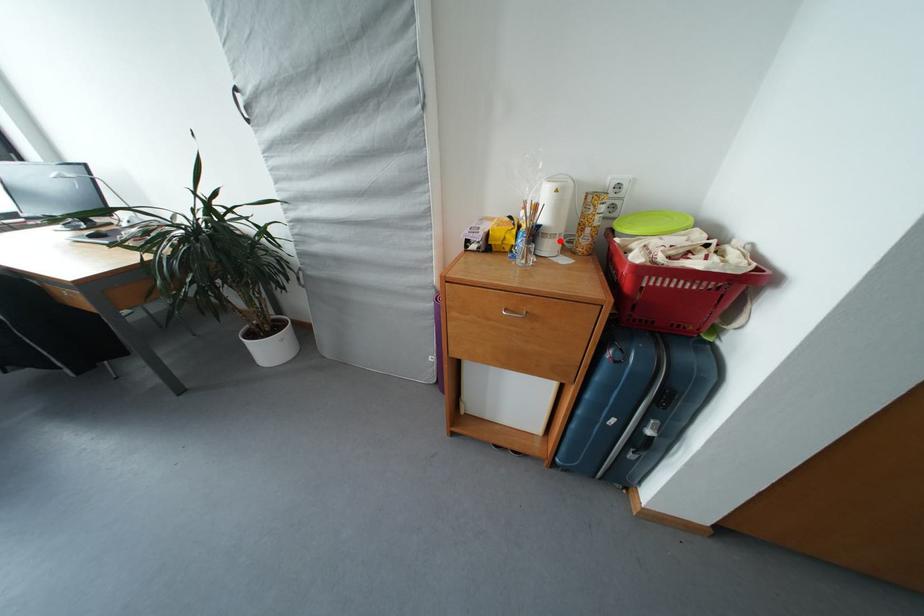
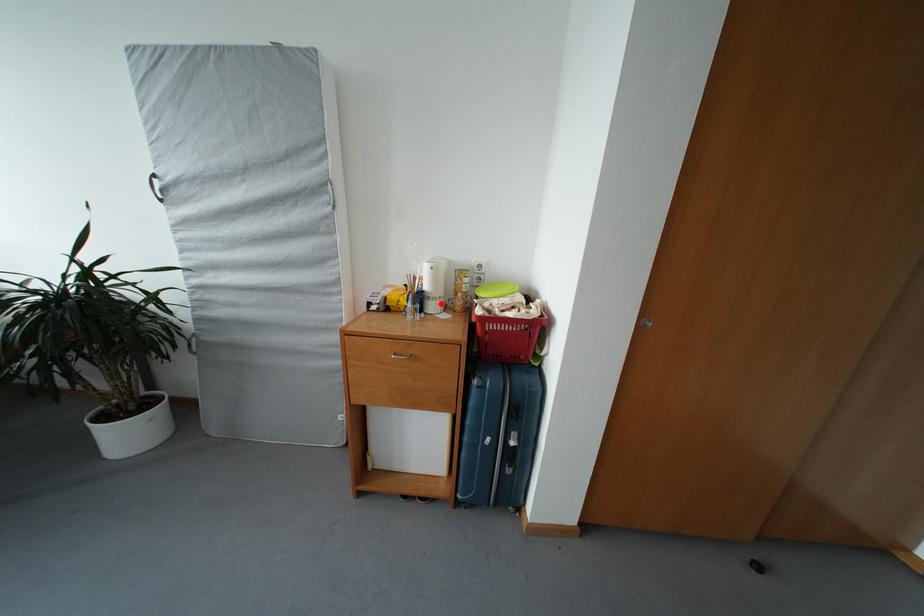
I am providing you with two images of the same scene from different viewpoints. A red point is marked on the first image and another point is marked on the second image. Is the red point in image1 aligned with the point shown in image2?

Yes